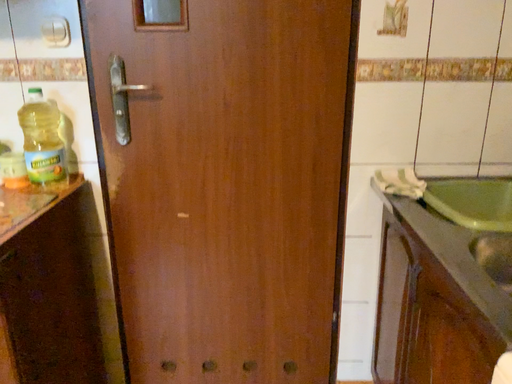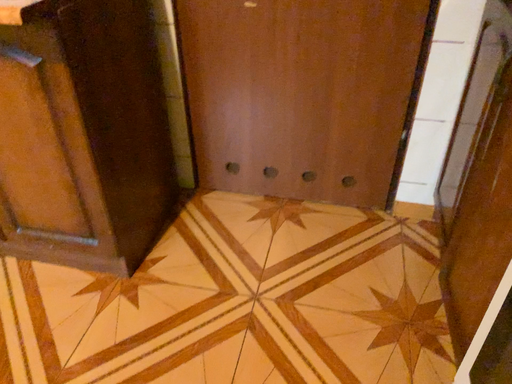
Question: Which way did the camera rotate in the video?

Choices:
 (A) rotated upward
 (B) rotated downward

Answer: (B)